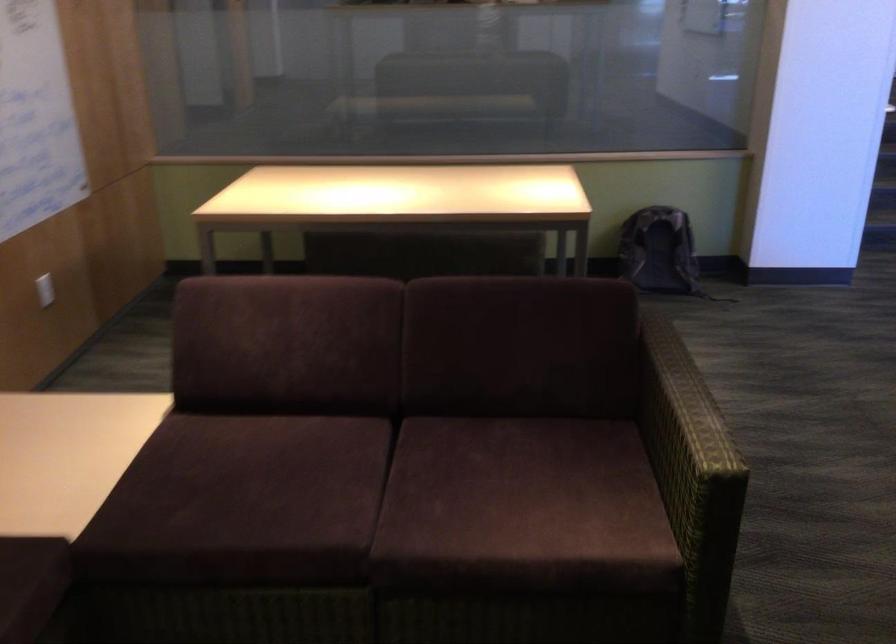
This screenshot has width=896, height=644. What do you see at coordinates (682, 404) in the screenshot?
I see `the sofa armrest` at bounding box center [682, 404].